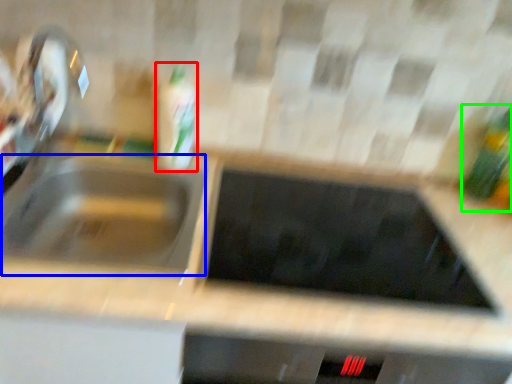
Question: Which object is positioned closest to bottle (highlighted by a red box)? Select from sink (highlighted by a blue box) and bottle (highlighted by a green box).

Choices:
 (A) sink
 (B) bottle

Answer: (A)